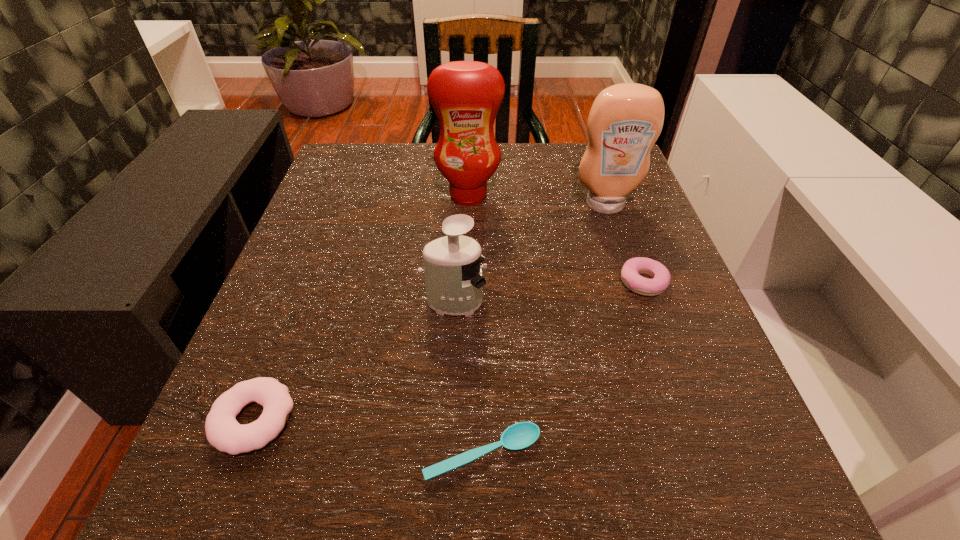
Identify the location of vacant point located on the front of the doughnut. (214, 521).

Where is `vacant space situated on the back of the spoon`? The height and width of the screenshot is (540, 960). vacant space situated on the back of the spoon is located at coordinates (482, 261).

Where is `doughnut that is at the near edge`? This screenshot has width=960, height=540. doughnut that is at the near edge is located at coordinates (223, 432).

The height and width of the screenshot is (540, 960). What are the coordinates of `spoon positioned at the near edge` in the screenshot? It's located at (521, 435).

Locate an element on the screen. object that is at the left edge is located at coordinates pyautogui.click(x=223, y=432).

Find the location of a particular element. The image size is (960, 540). condiment that is at the right edge is located at coordinates (625, 120).

Where is `pastry positioned at the right edge`? pastry positioned at the right edge is located at coordinates pyautogui.click(x=633, y=267).

The width and height of the screenshot is (960, 540). I want to click on object at the near left corner, so click(x=223, y=432).

You are a GUI agent. You are given a task and a screenshot of the screen. Output one action in this format:
    pyautogui.click(x=<x>, y=<y>)
    Task: Click on the object at the far right corner
    
    Given the screenshot: What is the action you would take?
    pyautogui.click(x=625, y=120)

Find the location of a particular element. This screenshot has height=540, width=960. vacant space at the far edge is located at coordinates (443, 199).